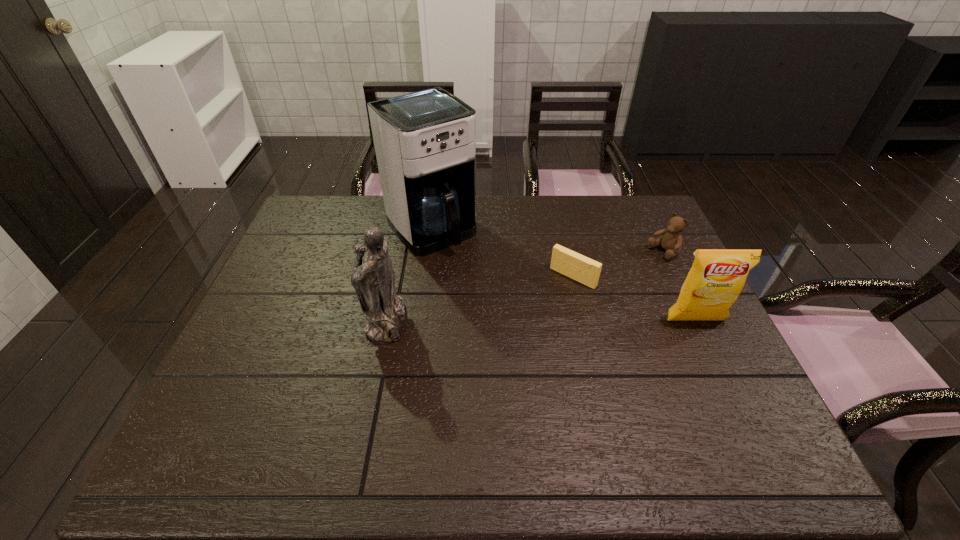
Identify the location of vacant area situated on the front-facing side of the fourth tallest object. (622, 273).

Identify the location of vacant space located on the front-facing side of the fourth tallest object. (594, 287).

Find the location of `vacant region located 0.350m on the front-facing side of the fourth tallest object`. vacant region located 0.350m on the front-facing side of the fourth tallest object is located at coordinates (564, 302).

Where is `vacant region located 0.090m at the front of the videotape with spools`? This screenshot has width=960, height=540. vacant region located 0.090m at the front of the videotape with spools is located at coordinates (545, 305).

I want to click on vacant space located 0.050m at the front of the videotape with spools, so click(553, 296).

Identify the location of vacant space located at the front of the videotape with spools. (524, 327).

Locate an element on the screen. vacant space located 0.360m on the front panel of the tallest object is located at coordinates [525, 328].

I want to click on vacant space located 0.330m on the front panel of the tallest object, so click(518, 321).

Where is `vacant space located on the front panel of the tallest object`? This screenshot has height=540, width=960. vacant space located on the front panel of the tallest object is located at coordinates point(525,328).

Find the location of `object positioned at the far edge`. object positioned at the far edge is located at coordinates (425, 142).